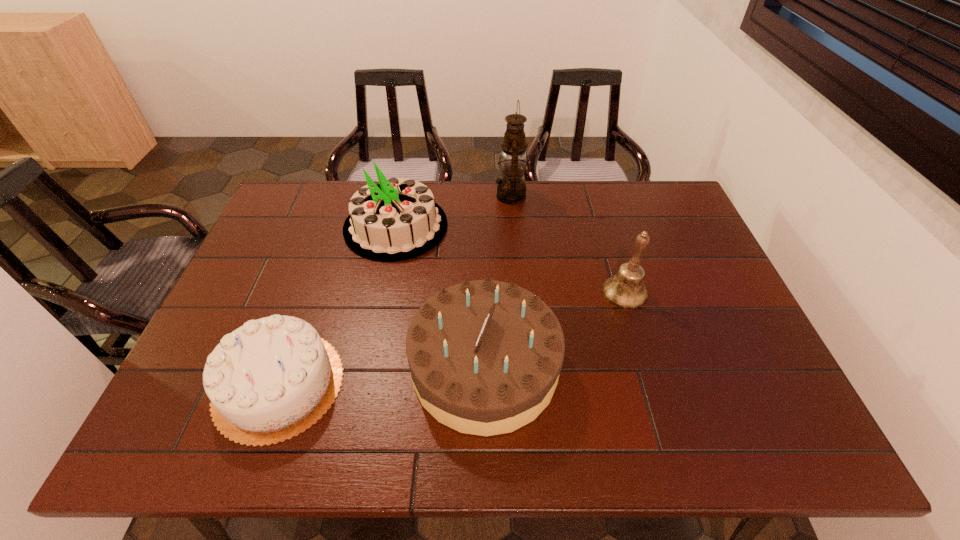
At what (x,y) coordinates should I click in order to perform the action: click on object that is positioned at the near left corner. Please return your answer as a coordinate pair (x, y). This screenshot has width=960, height=540. Looking at the image, I should click on (269, 380).

The height and width of the screenshot is (540, 960). I want to click on vacant space at the far edge, so click(x=564, y=220).

In the image, there is a desktop. Identify the location of vacant region at the near edge. Image resolution: width=960 pixels, height=540 pixels. (492, 441).

I want to click on free region at the left edge of the desktop, so click(x=290, y=295).

You are a GUI agent. You are given a task and a screenshot of the screen. Output one action in this format:
    pyautogui.click(x=<x>, y=<y>)
    Task: Click on the blank space at the right edge of the desktop
    
    Given the screenshot: What is the action you would take?
    pyautogui.click(x=651, y=239)

This screenshot has width=960, height=540. In order to click on vacant space at the far left corner in this screenshot , I will do (x=304, y=218).

You are a GUI agent. You are given a task and a screenshot of the screen. Output one action in this format:
    pyautogui.click(x=<x>, y=<y>)
    Task: Click on the free space at the far right corner of the desktop
    The height and width of the screenshot is (540, 960).
    Given the screenshot: What is the action you would take?
    pyautogui.click(x=684, y=215)

Locate an element on the screen. This screenshot has height=540, width=960. empty space between the bell and the tallest birthday cake is located at coordinates (511, 259).

At what (x,y) coordinates should I click in order to perform the action: click on vacant area that lies between the oil lamp and the rightmost object. Please return your answer as a coordinate pair (x, y). This screenshot has height=540, width=960. Looking at the image, I should click on tap(567, 244).

I want to click on blank region between the bell and the farthest birthday cake, so click(511, 259).